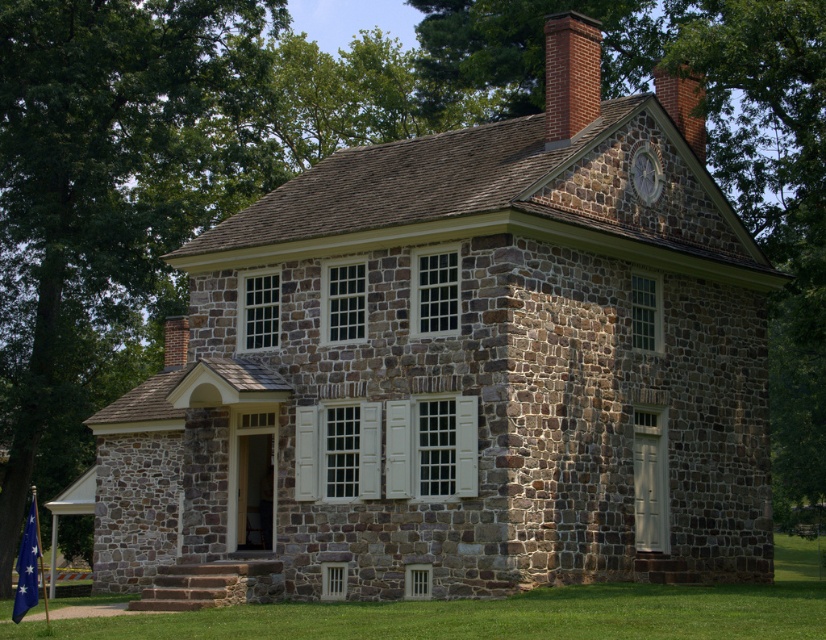
Who is positioned more to the right, green leafy tree at upper left or stone clock at upper center?

Positioned to the right is stone clock at upper center.

Based on the photo, between green leafy tree at upper left and stone clock at upper center, which one has less height?

Standing shorter between the two is stone clock at upper center.

Describe the element at coordinates (108, 200) in the screenshot. I see `green leafy tree at upper left` at that location.

Where is `green leafy tree at upper left`? green leafy tree at upper left is located at coordinates (108, 200).

Does green leafy tree at upper left lie behind blue fabric flag at lower left?

Yes, green leafy tree at upper left is behind blue fabric flag at lower left.

Between green leafy tree at upper left and blue fabric flag at lower left, which one is positioned lower?

blue fabric flag at lower left is lower down.

What are the coordinates of `green leafy tree at upper left` in the screenshot? It's located at (108, 200).

Find the location of a particular element. green leafy tree at upper left is located at coordinates (108, 200).

Is green grass at lower center to the left of brick chimney at upper right from the viewer's perspective?

Indeed, green grass at lower center is positioned on the left side of brick chimney at upper right.

Is green grass at lower center positioned at the back of brick chimney at upper right?

No.

You are a GUI agent. You are given a task and a screenshot of the screen. Output one action in this format:
    pyautogui.click(x=<x>, y=<y>)
    Task: Click on the green grass at lower center
    This screenshot has height=640, width=826.
    Given the screenshot: What is the action you would take?
    pyautogui.click(x=490, y=616)